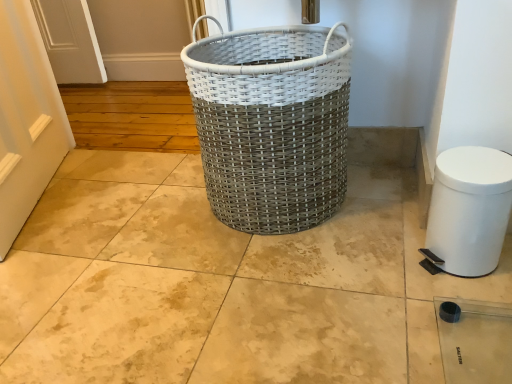
At what (x,y) coordinates should I click in order to perform the action: click on free point behind white plastic trash can at lower right. Please return your answer as a coordinate pair (x, y). The image size is (512, 384). Looking at the image, I should click on (394, 223).